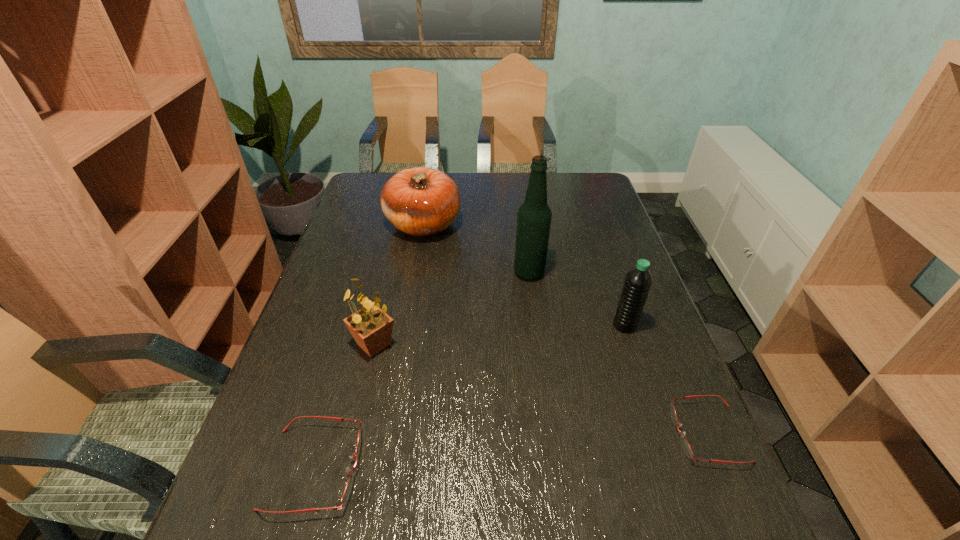
This screenshot has width=960, height=540. In order to click on the taller spectacles in this screenshot , I will do `click(347, 490)`.

Where is `the fifth tallest object`? The height and width of the screenshot is (540, 960). the fifth tallest object is located at coordinates (347, 490).

Identify the location of the shorter spectacles. The height and width of the screenshot is (540, 960). (686, 447).

This screenshot has width=960, height=540. In order to click on the right spectacles in this screenshot , I will do `click(686, 447)`.

At what (x,y) coordinates should I click in order to perform the action: click on the farthest object. Please return your answer as a coordinate pair (x, y). Looking at the image, I should click on (420, 201).

Where is `sunflower`? The height and width of the screenshot is (540, 960). sunflower is located at coordinates (371, 327).

Find the location of a particular element. This screenshot has height=540, width=960. water bottle is located at coordinates (638, 280).

You are a GUI agent. You are given a task and a screenshot of the screen. Output one action in this format:
    pyautogui.click(x=<x>, y=<y>)
    Task: Click on the fifth nearest object
    The image size is (960, 540).
    Given the screenshot: What is the action you would take?
    pyautogui.click(x=534, y=216)

The image size is (960, 540). Identify the location of the fourth object from left to right. (534, 216).

Locate an element on the screen. free space located on the lenses of the taller spectacles is located at coordinates (510, 468).